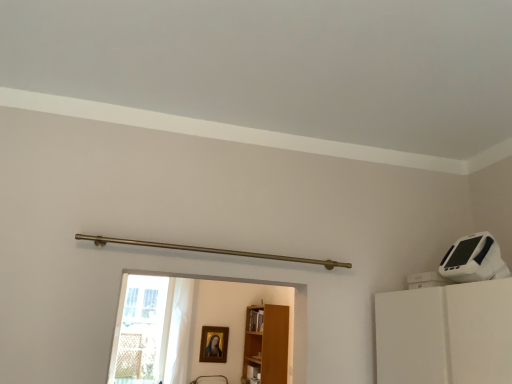
Question: Looking at their shapes, would you say light brown wood bookshelf at center is wider or thinner than gold-framed portrait at center?

Choices:
 (A) thin
 (B) wide

Answer: (B)

Question: Looking at the image, does light brown wood bookshelf at center seem bigger or smaller compared to gold-framed portrait at center?

Choices:
 (A) big
 (B) small

Answer: (A)

Question: Estimate the real-world distances between objects in this image. Which object is farther from the light brown wood bookshelf at center?

Choices:
 (A) transparent glass door at lower left
 (B) gold-framed portrait at center

Answer: (A)

Question: Estimate the real-world distances between objects in this image. Which object is farther from the transparent glass door at lower left?

Choices:
 (A) gold-framed portrait at center
 (B) light brown wood bookshelf at center

Answer: (B)